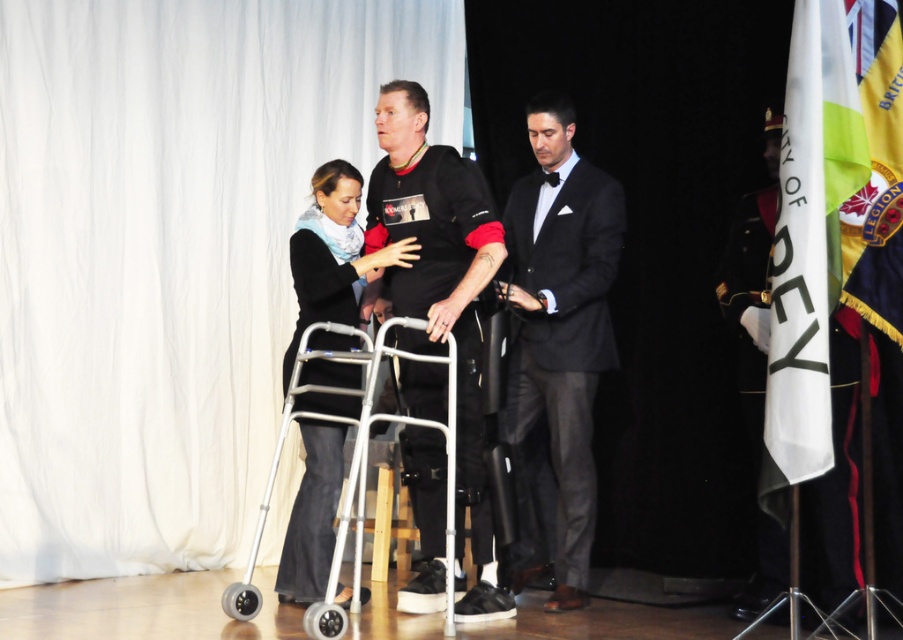
Can you confirm if white fabric flag at right is positioned to the left of gold/yellow fabric flag at right?

Indeed, white fabric flag at right is positioned on the left side of gold/yellow fabric flag at right.

Identify the location of white fabric flag at right. The width and height of the screenshot is (903, 640). (808, 244).

From the picture: Does shiny black suit at center have a smaller size compared to black fabric jacket at center?

Incorrect, shiny black suit at center is not smaller in size than black fabric jacket at center.

Is point (582, 449) closer to camera compared to point (320, 572)?

No, it is behind (320, 572).

Does point (585, 225) come in front of point (330, 490)?

No, it is not.

Where is `shiny black suit at center`? shiny black suit at center is located at coordinates (561, 321).

Does white matte curtain at upper left come behind shiny black suit at center?

Yes, white matte curtain at upper left is further from the viewer.

Based on the photo, how much distance is there between white matte curtain at upper left and shiny black suit at center?

white matte curtain at upper left is 5.82 feet from shiny black suit at center.

Where is `white matte curtain at upper left`? white matte curtain at upper left is located at coordinates (169, 253).